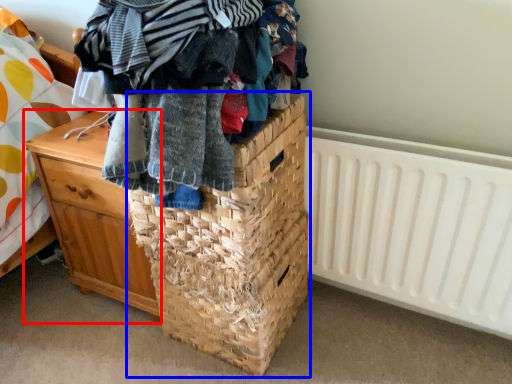
Question: Among these objects, which one is farthest to the camera, chest of drawers (highlighted by a red box) or basket (highlighted by a blue box)?

Choices:
 (A) chest of drawers
 (B) basket

Answer: (A)